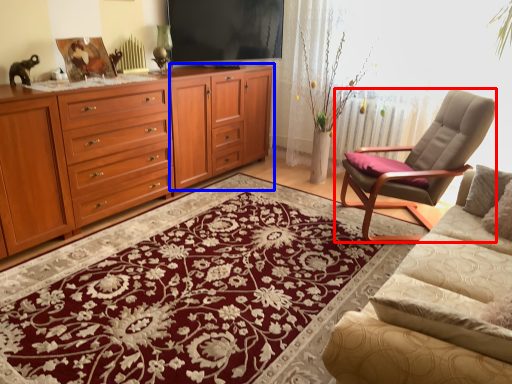
Question: Which object appears farthest to the camera in this image, chair (highlighted by a red box) or tv cabinet (highlighted by a blue box)?

Choices:
 (A) chair
 (B) tv cabinet

Answer: (B)